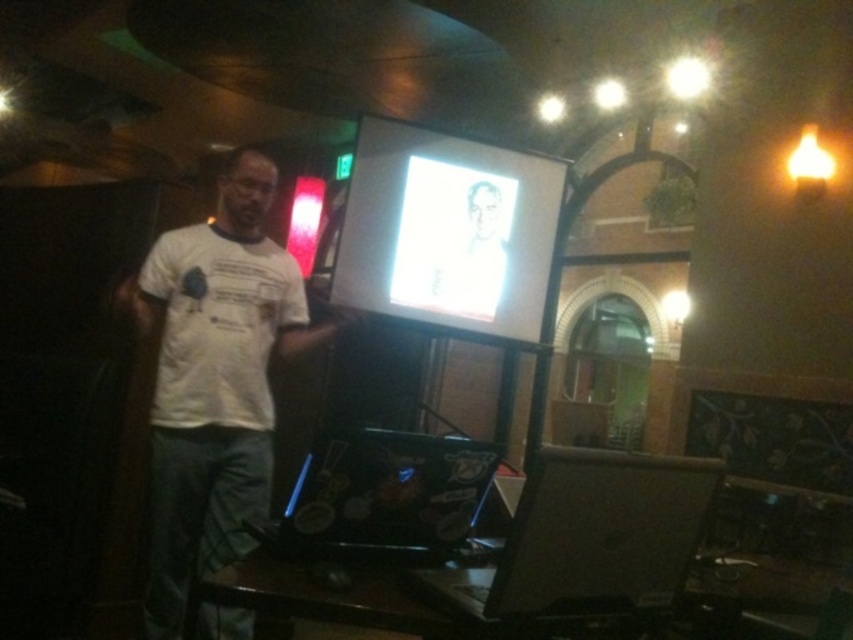
You are an attendee at the presentation. You notice the white glossy projection screen at center and the shiny black laptop at center. Which object is positioned higher in the image?

The white glossy projection screen at center is located above the shiny black laptop at center, so it is positioned higher in the image.